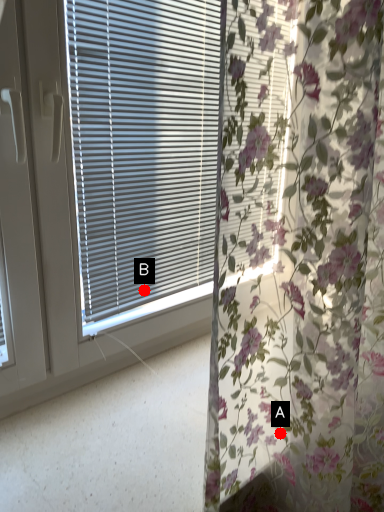
Question: Two points are circled on the image, labeled by A and B beside each circle. Which point appears farthest from the camera in this image?

Choices:
 (A) A is further
 (B) B is further

Answer: (B)